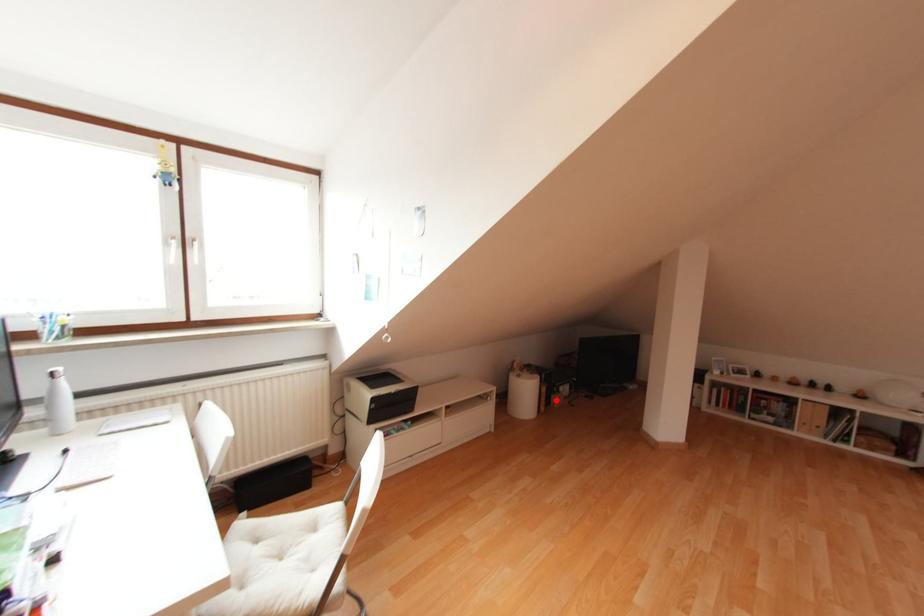
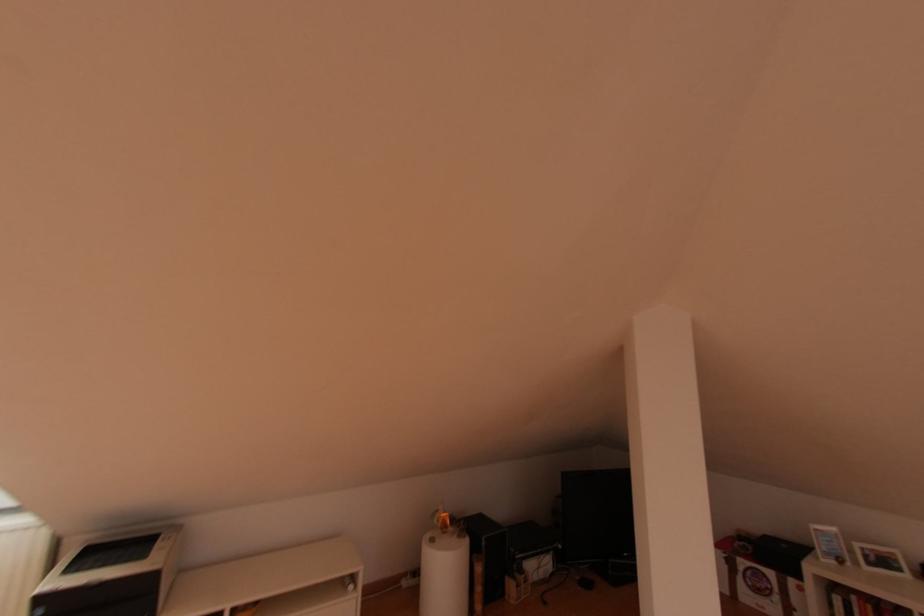
Locate, in the second image, the point that corresponds to the highlighted location in the first image.

(511, 589)